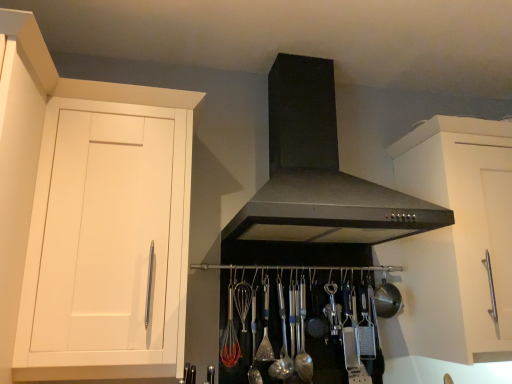
I want to click on satin silver spoon at center, the 4th utensil from the left, so click(303, 339).

The image size is (512, 384). What do you see at coordinates (303, 339) in the screenshot?
I see `satin silver spoon at center, the 4th utensil from the left` at bounding box center [303, 339].

What do you see at coordinates (387, 299) in the screenshot? This screenshot has width=512, height=384. I see `metallic silver bowl at center` at bounding box center [387, 299].

What is the approximate height of white matte cabinet at left, which is the 2th cabinetry from right to left?

It is 32.76 inches.

Locate an element on the screen. white matte cabinet at right, arranged as the second cabinetry when viewed from the left is located at coordinates (454, 242).

Describe the element at coordinates (265, 327) in the screenshot. I see `polished silver spoon at center, marked as the second utensil in a left-to-right arrangement` at that location.

At what (x,y) coordinates should I click in order to perform the action: click on satin silver spoon at center, the 4th utensil from the left. Please return your answer as a coordinate pair (x, y). Looking at the image, I should click on (303, 339).

Is metallic silver bowl at center positioned with its back to polished silver spoon at center, which ranks as the 3th utensil in right-to-left order?

No, metallic silver bowl at center is not facing the opposite direction of polished silver spoon at center, which ranks as the 3th utensil in right-to-left order.

Is metallic silver bowl at center positioned far away from polished silver spoon at center, marked as the second utensil in a left-to-right arrangement?

No.

Considering the sizes of metallic silver bowl at center and polished silver spoon at center, marked as the second utensil in a left-to-right arrangement, in the image, is metallic silver bowl at center taller or shorter than polished silver spoon at center, marked as the second utensil in a left-to-right arrangement,?

Clearly, metallic silver bowl at center is shorter compared to polished silver spoon at center, marked as the second utensil in a left-to-right arrangement.

Consider the image. Who is bigger, metallic silver bowl at center or polished silver spoon at center, marked as the second utensil in a left-to-right arrangement?

Bigger between the two is metallic silver bowl at center.

Which of these two, white matte cabinet at left, which is the 2th cabinetry from right to left, or satin silver spoon at center, marked as the 4th utensil in a right-to-left arrangement, is smaller?

satin silver spoon at center, marked as the 4th utensil in a right-to-left arrangement, is smaller.

Does point (4, 141) appear closer or farther from the camera than point (256, 286)?

Point (4, 141) appears to be closer to the viewer than point (256, 286).

Consider the image. From a real-world perspective, who is located higher, white matte cabinet at left, which is the 2th cabinetry from right to left, or satin silver spoon at center, marked as the 1th utensil in a left-to-right arrangement?

white matte cabinet at left, which is the 2th cabinetry from right to left, is physically above.

How different are the orientations of satin silver spoon at center, the 4th utensil from the left, and white matte cabinet at right, arranged as the second cabinetry when viewed from the left, in degrees?

They differ by 0.0455 degrees in their facing directions.

Does satin silver spoon at center, the 1th utensil when ordered from right to left, appear on the right side of white matte cabinet at right, the first cabinetry positioned from the right?

No.

From a real-world perspective, does satin silver spoon at center, the 1th utensil when ordered from right to left, sit lower than white matte cabinet at right, arranged as the second cabinetry when viewed from the left?

Yes, from a real-world perspective, satin silver spoon at center, the 1th utensil when ordered from right to left, is under white matte cabinet at right, arranged as the second cabinetry when viewed from the left.

Find the location of a particular element. the 2nd cabinetry above the satin silver spoon at center, the 1th utensil when ordered from right to left (from a real-world perspective) is located at coordinates (454, 242).

From a real-world perspective, is satin silver spoon at center, placed as the third utensil when sorted from left to right, below satin silver spoon at center, the 4th utensil from the left?

Yes.

Between satin silver spoon at center, which appears as the second utensil when viewed from the right, and satin silver spoon at center, the 4th utensil from the left, which one has smaller size?

satin silver spoon at center, the 4th utensil from the left, is smaller.

Can you confirm if satin silver spoon at center, which appears as the second utensil when viewed from the right, is taller than satin silver spoon at center, the 4th utensil from the left?

Yes, satin silver spoon at center, which appears as the second utensil when viewed from the right, is taller than satin silver spoon at center, the 4th utensil from the left.

Looking at the image, does white matte cabinet at left, which is the 2th cabinetry from right to left, seem bigger or smaller compared to polished silver spoon at center, which ranks as the 3th utensil in right-to-left order?

Considering their sizes, white matte cabinet at left, which is the 2th cabinetry from right to left, takes up more space than polished silver spoon at center, which ranks as the 3th utensil in right-to-left order.

Looking at this image, can polished silver spoon at center, marked as the second utensil in a left-to-right arrangement, be found inside white matte cabinet at left, which is the 1th cabinetry from left to right?

Definitely not — polished silver spoon at center, marked as the second utensil in a left-to-right arrangement, is not inside white matte cabinet at left, which is the 1th cabinetry from left to right.

Can you tell me how much white matte cabinet at left, which is the 2th cabinetry from right to left, and polished silver spoon at center, which ranks as the 3th utensil in right-to-left order, differ in facing direction?

There is a 0.0895-degree angle between the facing directions of white matte cabinet at left, which is the 2th cabinetry from right to left, and polished silver spoon at center, which ranks as the 3th utensil in right-to-left order.

From the image's perspective, is white matte cabinet at left, which is the 2th cabinetry from right to left, on polished silver spoon at center, which ranks as the 3th utensil in right-to-left order?

Yes, from the image's perspective, white matte cabinet at left, which is the 2th cabinetry from right to left, is on top of polished silver spoon at center, which ranks as the 3th utensil in right-to-left order.

Looking at this image, could black matte fume hood at center be considered to be inside satin silver spoon at center, marked as the 4th utensil in a right-to-left arrangement?

No, black matte fume hood at center is not surrounded by satin silver spoon at center, marked as the 4th utensil in a right-to-left arrangement.

From the image's perspective, is satin silver spoon at center, marked as the 1th utensil in a left-to-right arrangement, over black matte fume hood at center?

Actually, satin silver spoon at center, marked as the 1th utensil in a left-to-right arrangement, appears below black matte fume hood at center in the image.

Is satin silver spoon at center, marked as the 4th utensil in a right-to-left arrangement, positioned far away from black matte fume hood at center?

Actually, satin silver spoon at center, marked as the 4th utensil in a right-to-left arrangement, and black matte fume hood at center are a little close together.

Starting from the black matte fume hood at center, which utensil is the 4th one to the left? Please provide its 2D coordinates.

[(254, 343)]

From a real-world perspective, which utensil is the 2nd one underneath the satin silver spoon at center, the 1th utensil when ordered from right to left? Please provide its 2D coordinates.

[(254, 343)]

Does satin silver spoon at center, the 4th utensil from the left, have a smaller size compared to satin silver spoon at center, marked as the 4th utensil in a right-to-left arrangement?

Indeed, satin silver spoon at center, the 4th utensil from the left, has a smaller size compared to satin silver spoon at center, marked as the 4th utensil in a right-to-left arrangement.

Is satin silver spoon at center, marked as the 4th utensil in a right-to-left arrangement, surrounded by satin silver spoon at center, the 4th utensil from the left?

No, satin silver spoon at center, the 4th utensil from the left, does not contain satin silver spoon at center, marked as the 4th utensil in a right-to-left arrangement.

I want to click on appliance above the polished silver spoon at center, which ranks as the 3th utensil in right-to-left order (from the image's perspective), so [x=387, y=299].

I want to click on the 2nd utensil behind the white matte cabinet at left, which is the 1th cabinetry from left to right, so click(x=254, y=343).

From the image, which object appears to be nearer to satin silver spoon at center, which appears as the second utensil when viewed from the right, white matte cabinet at left, which is the 1th cabinetry from left to right, or satin silver spoon at center, marked as the 1th utensil in a left-to-right arrangement?

satin silver spoon at center, marked as the 1th utensil in a left-to-right arrangement.

Considering their positions, is metallic silver bowl at center positioned further to satin silver spoon at center, placed as the third utensil when sorted from left to right, than satin silver spoon at center, marked as the 1th utensil in a left-to-right arrangement?

Among the two, metallic silver bowl at center is located further to satin silver spoon at center, placed as the third utensil when sorted from left to right.

Looking at the image, which one is located closer to satin silver spoon at center, marked as the 1th utensil in a left-to-right arrangement, white matte cabinet at left, which is the 1th cabinetry from left to right, or satin silver spoon at center, placed as the third utensil when sorted from left to right?

satin silver spoon at center, placed as the third utensil when sorted from left to right, is positioned closer to the anchor satin silver spoon at center, marked as the 1th utensil in a left-to-right arrangement.

When comparing their distances from white matte cabinet at right, arranged as the second cabinetry when viewed from the left, does polished silver spoon at center, which ranks as the 3th utensil in right-to-left order, or metallic silver bowl at center seem closer?

metallic silver bowl at center.

When comparing their distances from white matte cabinet at right, arranged as the second cabinetry when viewed from the left, does satin silver spoon at center, marked as the 4th utensil in a right-to-left arrangement, or polished silver spoon at center, which ranks as the 3th utensil in right-to-left order, seem closer?

polished silver spoon at center, which ranks as the 3th utensil in right-to-left order, is closer to white matte cabinet at right, arranged as the second cabinetry when viewed from the left.

Based on their spatial positions, is satin silver spoon at center, marked as the 1th utensil in a left-to-right arrangement, or satin silver spoon at center, the 1th utensil when ordered from right to left, further from white matte cabinet at left, which is the 2th cabinetry from right to left?

satin silver spoon at center, the 1th utensil when ordered from right to left, lies further to white matte cabinet at left, which is the 2th cabinetry from right to left, than the other object.

From the picture: Looking at the image, which one is located closer to metallic silver bowl at center, satin silver spoon at center, placed as the third utensil when sorted from left to right, or white matte cabinet at right, arranged as the second cabinetry when viewed from the left?

white matte cabinet at right, arranged as the second cabinetry when viewed from the left, lies closer to metallic silver bowl at center than the other object.

When comparing their distances from white matte cabinet at right, arranged as the second cabinetry when viewed from the left, does satin silver spoon at center, the 1th utensil when ordered from right to left, or white matte cabinet at left, which is the 2th cabinetry from right to left, seem further?

white matte cabinet at left, which is the 2th cabinetry from right to left, is positioned further to the anchor white matte cabinet at right, arranged as the second cabinetry when viewed from the left.

This screenshot has width=512, height=384. I want to click on fume hood between satin silver spoon at center, placed as the third utensil when sorted from left to right, and white matte cabinet at right, the first cabinetry positioned from the right, from left to right, so click(x=320, y=173).

You are a GUI agent. You are given a task and a screenshot of the screen. Output one action in this format:
    pyautogui.click(x=<x>, y=<y>)
    Task: Click on the appliance between black matte fume hood at center and satin silver spoon at center, marked as the 1th utensil in a left-to-right arrangement, vertically
    
    Given the screenshot: What is the action you would take?
    pyautogui.click(x=387, y=299)

Where is `appliance between black matte fume hood at center and polished silver spoon at center, which ranks as the 3th utensil in right-to-left order, in the vertical direction`? This screenshot has width=512, height=384. appliance between black matte fume hood at center and polished silver spoon at center, which ranks as the 3th utensil in right-to-left order, in the vertical direction is located at coordinates (387, 299).

The width and height of the screenshot is (512, 384). I want to click on fume hood between satin silver spoon at center, the 1th utensil when ordered from right to left, and white matte cabinet at right, arranged as the second cabinetry when viewed from the left, in the horizontal direction, so click(x=320, y=173).